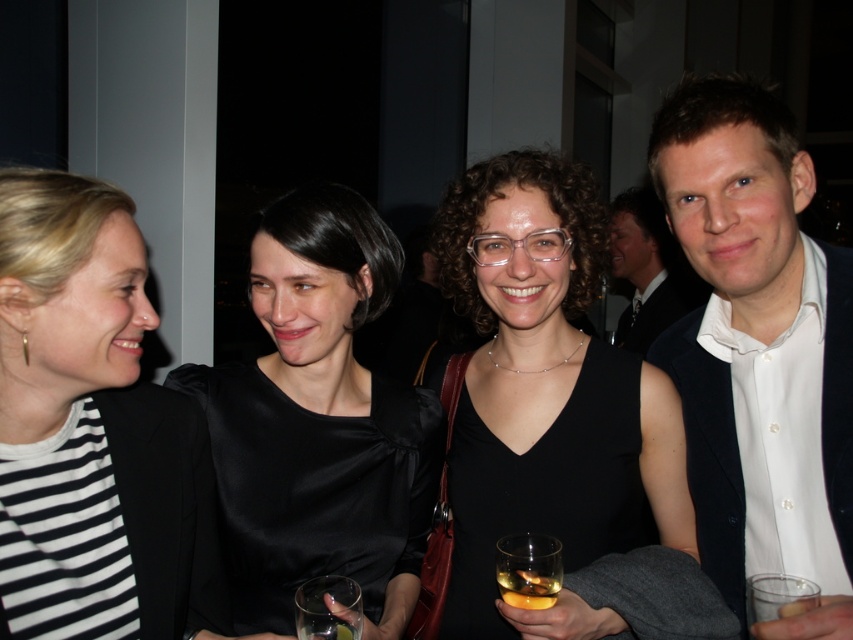
Between black striped shirt at left and translucent glass beverage at lower center, which one appears on the left side from the viewer's perspective?

From the viewer's perspective, black striped shirt at left appears more on the left side.

Does point (91, 218) lie in front of point (543, 595)?

Yes, it is in front of point (543, 595).

The height and width of the screenshot is (640, 853). What are the coordinates of `black striped shirt at left` in the screenshot? It's located at (103, 378).

Who is shorter, translucent glass at center or translucent plastic cup at lower right?

Standing shorter between the two is translucent plastic cup at lower right.

Is translucent glass at center to the right of translucent plastic cup at lower right from the viewer's perspective?

In fact, translucent glass at center is to the left of translucent plastic cup at lower right.

Who is more distant from viewer, (x=560, y=580) or (x=793, y=579)?

The point (x=560, y=580) is more distant.

I want to click on translucent glass at center, so click(527, 570).

Between white shirt at upper right and translucent plastic cup at lower right, which one has less height?

Standing shorter between the two is translucent plastic cup at lower right.

Does white shirt at upper right have a larger size compared to translucent plastic cup at lower right?

Correct, white shirt at upper right is larger in size than translucent plastic cup at lower right.

Who is more forward, (659, 218) or (792, 605)?

Positioned in front is point (792, 605).

The height and width of the screenshot is (640, 853). I want to click on white shirt at upper right, so click(x=648, y=269).